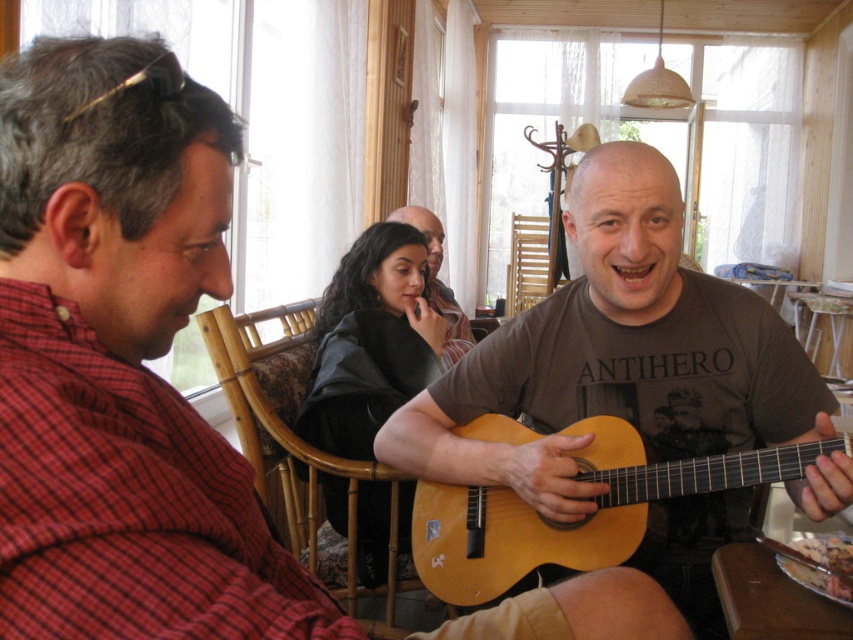
Who is higher up, matte brown guitar at center or light brown wooden guitar at center?

matte brown guitar at center is above.

This screenshot has height=640, width=853. I want to click on matte brown guitar at center, so click(616, 355).

This screenshot has width=853, height=640. Identify the location of matte brown guitar at center. (616, 355).